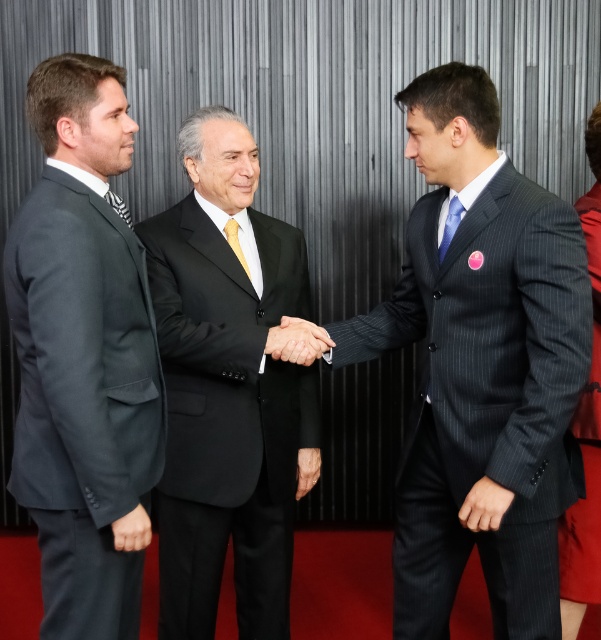
You are a photographer in a professional setting. You need to capture a closeup shot of the smooth black hand at center and the yellow satin tie at center. What is the minimum distance your camera needs to be from the subjects to ensure both are in frame?

The smooth black hand at center and yellow satin tie at center are 10.28 inches apart. To capture both in a closeup shot, the camera should be positioned at least 10.28 inches away from the subjects to ensure they are fully in frame.

You are a photographer taking a group photo of the three men. You notice the blue silk tie at center and the striped fabric tie at left. Which tie should you adjust to ensure both ties are of equal size in the photo?

You should adjust the blue silk tie at center because it is smaller than the striped fabric tie at left. To make them appear equal in size, you can move the blue silk tie at center closer to the camera or move the striped fabric tie at left farther away.